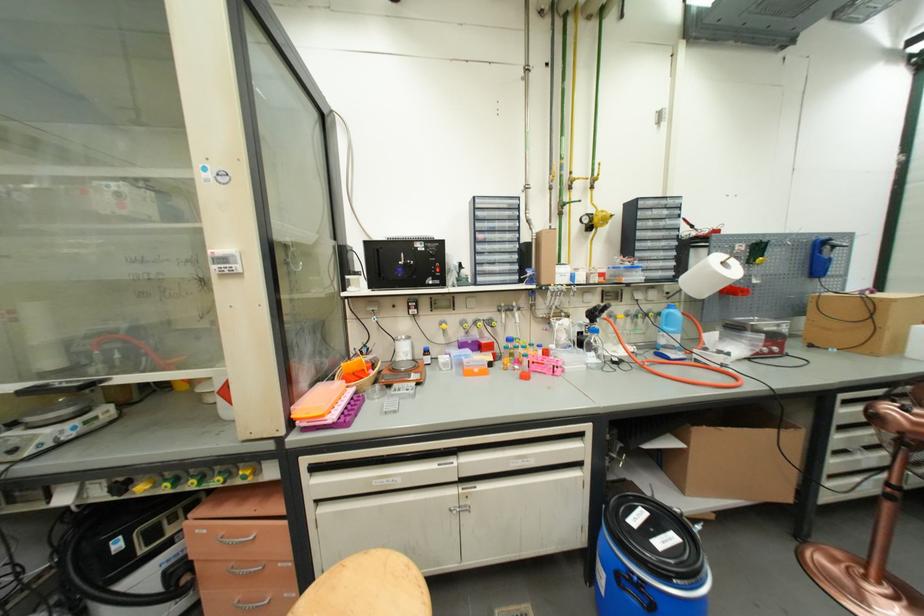
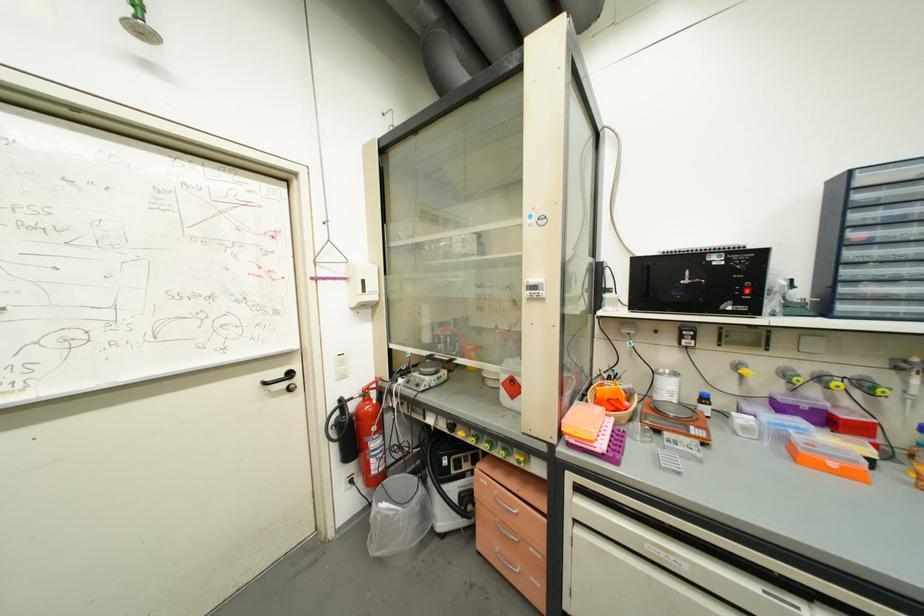
Locate, in the second image, the point that corresponds to the point at 256,573 in the first image.

(516, 540)